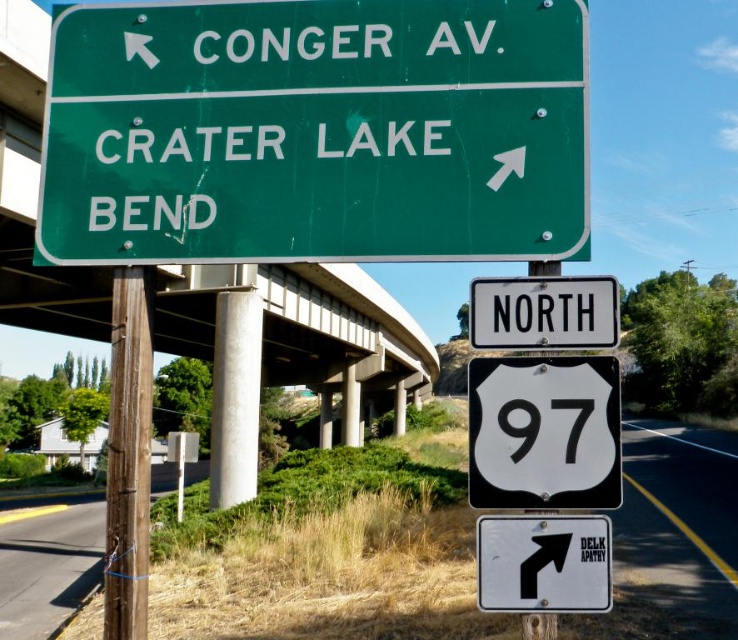
Question: Does green matte sign at upper center come behind green metal sign at upper left?

Choices:
 (A) no
 (B) yes

Answer: (A)

Question: Which point is farther to the camera?

Choices:
 (A) white plastic highway sign at center
 (B) white plastic sign at center
 (C) white glossy shield at center
 (D) green matte sign at upper center

Answer: (A)

Question: Which is farther from the white plastic sign at center?

Choices:
 (A) green metal sign at upper left
 (B) white plastic arrow at upper center

Answer: (A)

Question: Can you confirm if white plastic highway sign at center is thinner than green metal sign at upper left?

Choices:
 (A) yes
 (B) no

Answer: (B)

Question: Is green metal sign at upper left smaller than brown wooden pole at left?

Choices:
 (A) no
 (B) yes

Answer: (A)

Question: Which of the following is the farthest from the observer?

Choices:
 (A) green matte sign at upper center
 (B) white plastic highway sign at center

Answer: (B)